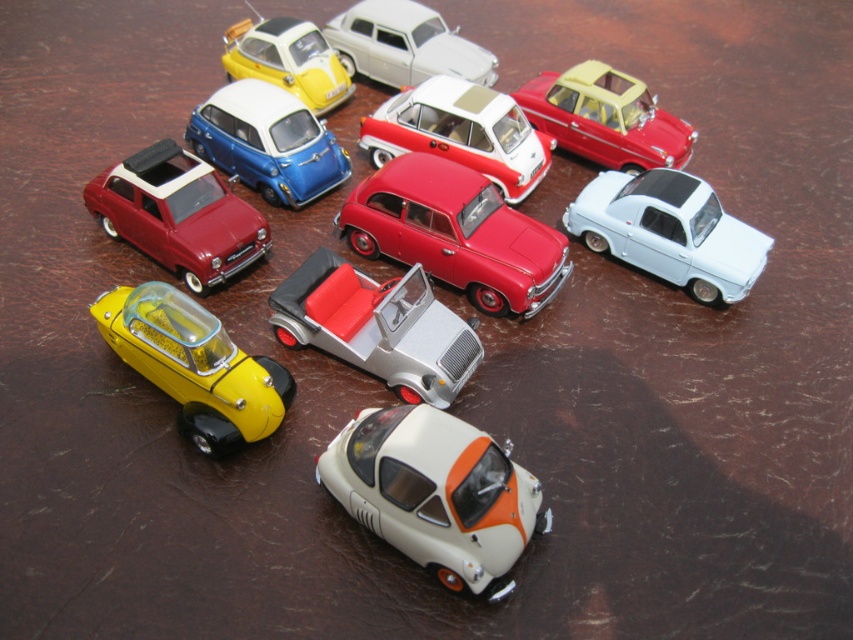
Question: Is white matte car at center smaller than matte blue car at upper center?

Choices:
 (A) no
 (B) yes

Answer: (A)

Question: Which is farther from the shiny yellow car at bottom left?

Choices:
 (A) silver metallic convertible at center
 (B) matte yellow car at upper right
 (C) shiny red car at center

Answer: (B)

Question: Can you confirm if matte red car at center is bigger than matte blue car at upper center?

Choices:
 (A) no
 (B) yes

Answer: (B)

Question: Which point is closer to the camera?

Choices:
 (A) matte red car at center
 (B) matte blue car at upper center
 (C) matte red car at upper left
 (D) white matte car at upper center

Answer: (C)

Question: Which point is closer to the camera taking this photo?

Choices:
 (A) (460, 160)
 (B) (691, 180)
 (C) (289, 154)
 (D) (422, 212)

Answer: (D)

Question: Is silver metallic convertible at center thinner than matte yellow car at upper left?

Choices:
 (A) no
 (B) yes

Answer: (A)